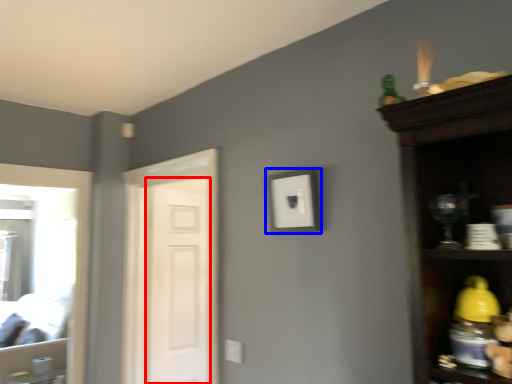
Question: Which object is further to the camera taking this photo, screen door (highlighted by a red box) or picture frame (highlighted by a blue box)?

Choices:
 (A) screen door
 (B) picture frame

Answer: (A)